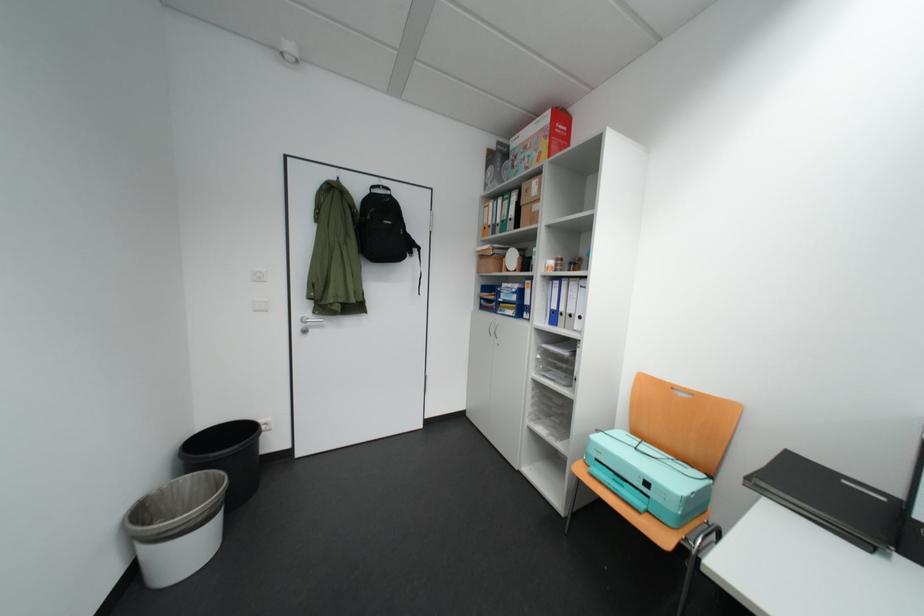
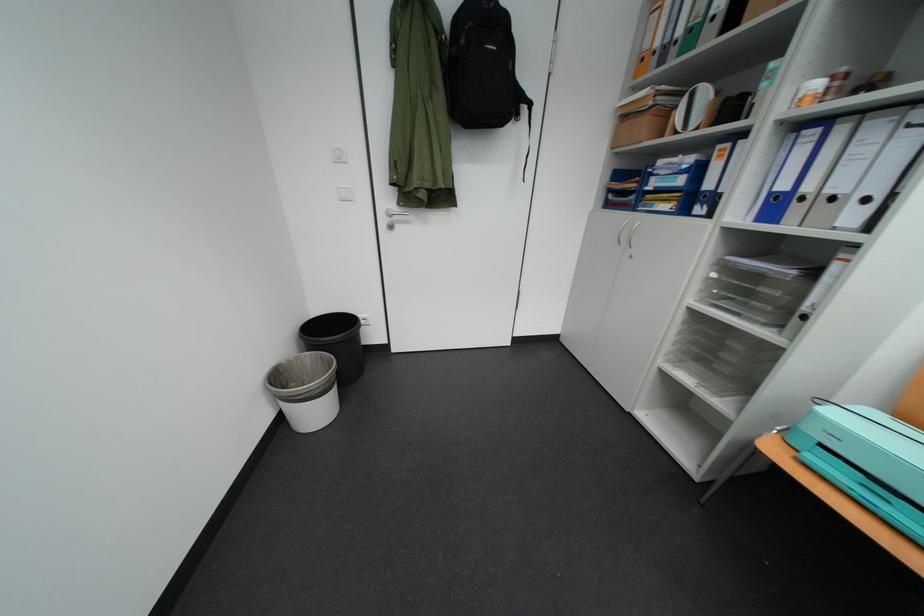
Which direction would the cameraman need to move to produce the second image?

The cameraman walked toward left, forward.